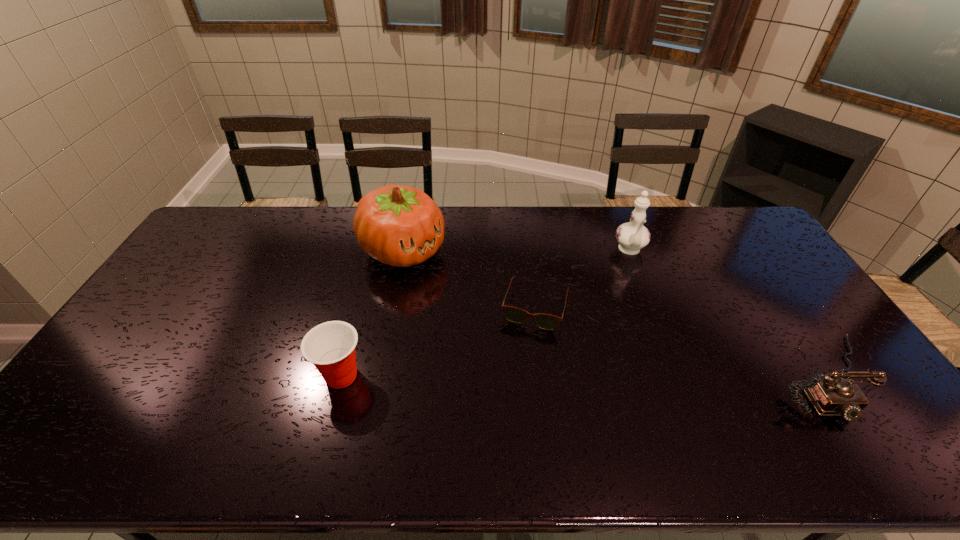
I want to click on vacant space that's between the telephone and the fourth object from left to right, so click(728, 314).

Find the location of `free space between the pumpkin and the rightmost object`. free space between the pumpkin and the rightmost object is located at coordinates (614, 314).

Find the location of a particular element. This screenshot has height=540, width=960. vacant area between the chinaware and the spectacles is located at coordinates (583, 279).

I want to click on free space between the chinaware and the pumpkin, so click(516, 251).

I want to click on empty location between the chinaware and the shortest object, so click(x=583, y=279).

Identify the location of vacant area that lies between the cup and the chinaware. (486, 313).

Locate an element on the screen. The width and height of the screenshot is (960, 540). vacant space that's between the pumpkin and the shortest object is located at coordinates (469, 279).

Find the location of a particular element. object that stands as the closest to the spectacles is located at coordinates (400, 226).

Identify which object is the second closest to the cup. Please provide its 2D coordinates. Your answer should be formatted as a tuple, i.e. [(x, y)], where the tuple contains the x and y coordinates of a point satisfying the conditions above.

[(545, 321)]

The width and height of the screenshot is (960, 540). Identify the location of free location that satisfies the following two spatial constraints: 1. on the back side of the cup; 2. on the right side of the shortest object. (360, 308).